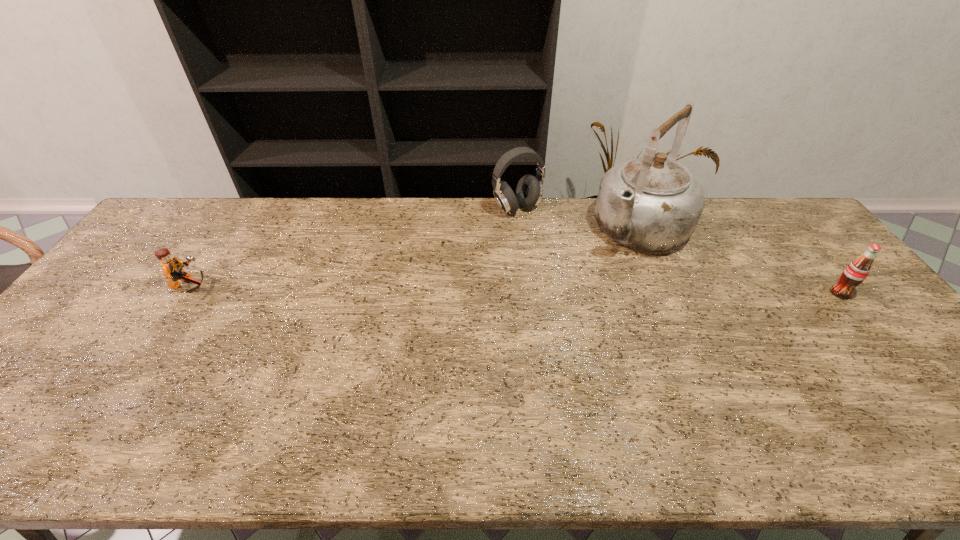
Locate an element on the screen. This screenshot has width=960, height=540. free space at the near edge of the desktop is located at coordinates (403, 400).

This screenshot has width=960, height=540. I want to click on vacant space at the left edge, so click(x=62, y=363).

This screenshot has width=960, height=540. In the image, there is a desktop. What are the coordinates of `vacant space at the right edge` in the screenshot? It's located at (781, 256).

At what (x,y) coordinates should I click in order to perform the action: click on vacant space that's between the kettle and the soda. Please return your answer as a coordinate pair (x, y). Image resolution: width=960 pixels, height=540 pixels. Looking at the image, I should click on pos(740,261).

Locate an element on the screen. free spot between the third shortest object and the leftmost object is located at coordinates (354, 248).

Where is `free space between the shortest object and the second tallest object`? This screenshot has height=540, width=960. free space between the shortest object and the second tallest object is located at coordinates (354, 248).

This screenshot has height=540, width=960. In order to click on empty space between the tallest object and the third object from right to left in this screenshot , I will do `click(579, 219)`.

Where is `free spot between the second object from right to left and the second shortest object`? This screenshot has width=960, height=540. free spot between the second object from right to left and the second shortest object is located at coordinates (740, 261).

Image resolution: width=960 pixels, height=540 pixels. I want to click on unoccupied position between the kettle and the third shortest object, so click(x=579, y=219).

In order to click on free space between the soda and the tallest object in this screenshot , I will do `click(740, 261)`.